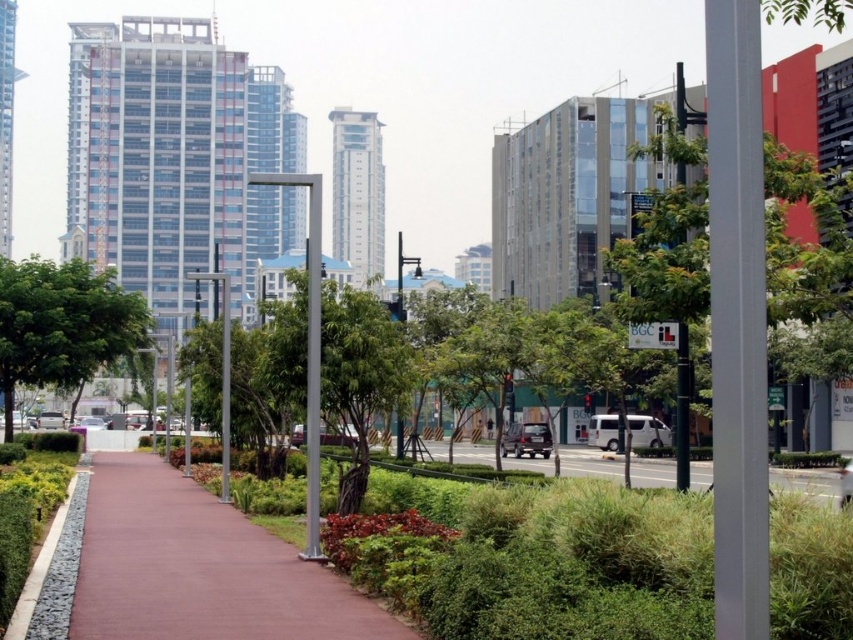
Does green leafy tree at left have a greater height compared to green grass at center?

Yes, green leafy tree at left is taller than green grass at center.

Is point (10, 410) less distant than point (666, 484)?

No.

Where is `green leafy tree at left`? green leafy tree at left is located at coordinates (62, 324).

Where is `green leafy tree at left`? This screenshot has width=853, height=640. green leafy tree at left is located at coordinates (62, 324).

Identify the location of brown rubber pavement at center. (200, 568).

Who is shorter, brown rubber pavement at center or green leafy tree at left?

Standing shorter between the two is brown rubber pavement at center.

I want to click on brown rubber pavement at center, so point(200,568).

Is green leafy tree at center-right below green leafy tree at left?

Correct, green leafy tree at center-right is located below green leafy tree at left.

Does point (659, 150) come behind point (20, 285)?

No, it is in front of (20, 285).

Identify the location of green leafy tree at center-right. (805, 244).